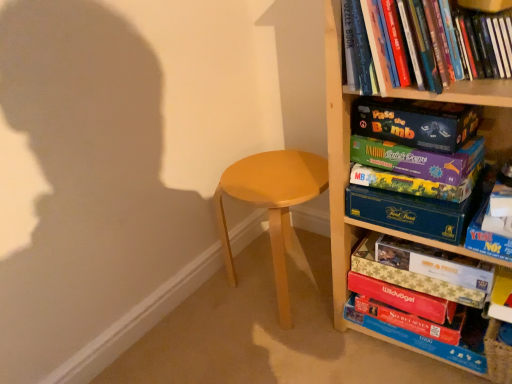
Image resolution: width=512 pixels, height=384 pixels. Identify the location of empty space that is ontop of matte purple board game at center-right, which appears as the fifth paperback book when ordered from the bottom (from a real-world perspective). (404, 162).